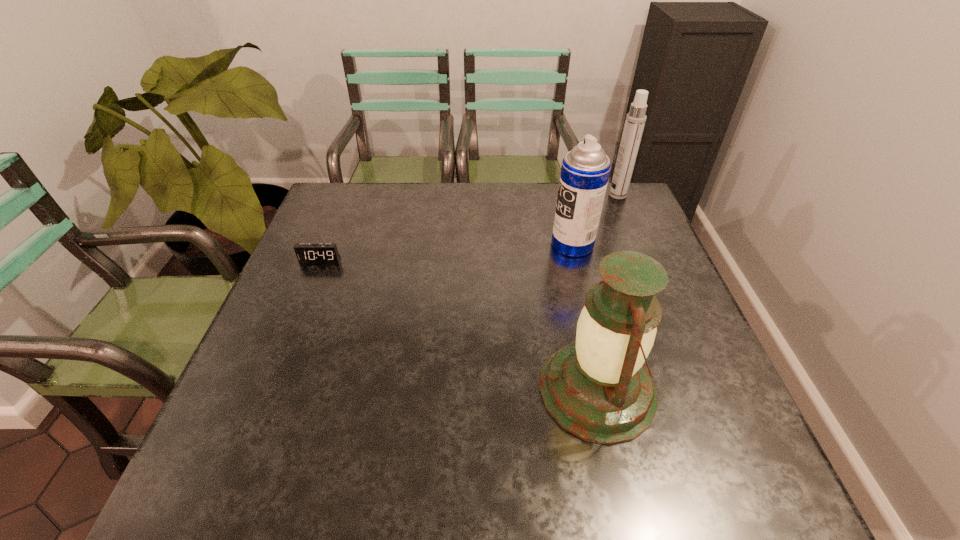
The image size is (960, 540). Identify the location of blank space at the near edge of the desktop. (615, 474).

This screenshot has width=960, height=540. In order to click on free point at the left edge in this screenshot , I will do `click(360, 231)`.

The image size is (960, 540). Find the location of `free location at the far left corner of the desktop`. free location at the far left corner of the desktop is located at coordinates (349, 211).

Identify the location of free space at the near left corner of the desktop. (231, 478).

In the image, there is a desktop. At what (x,y) coordinates should I click in order to perform the action: click on vacant space at the far right corner. Please return your answer as a coordinate pair (x, y). Looking at the image, I should click on (610, 207).

Locate an element on the screen. This screenshot has width=960, height=540. blank area at the near right corner is located at coordinates (714, 462).

Where is `free space between the shortest object and the nearest object`? This screenshot has width=960, height=540. free space between the shortest object and the nearest object is located at coordinates (459, 325).

You are a GUI agent. You are given a task and a screenshot of the screen. Output one action in this format:
    pyautogui.click(x=<x>, y=<y>)
    Task: Click on the empty space between the alarm clock and the left aerosol can
    
    Given the screenshot: What is the action you would take?
    pyautogui.click(x=446, y=252)

This screenshot has width=960, height=540. I want to click on free space between the shortest object and the rightmost object, so click(468, 227).

Find the location of `vacant area that lies between the rightmost object and the alarm clock`. vacant area that lies between the rightmost object and the alarm clock is located at coordinates (468, 227).